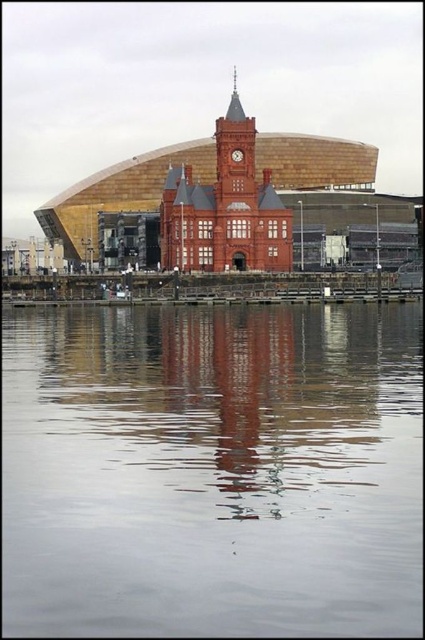
Question: Is smooth gray water at center above matte brick clock tower at center?

Choices:
 (A) yes
 (B) no

Answer: (B)

Question: Can you confirm if smooth gray water at center is bigger than matte brick clock tower at center?

Choices:
 (A) yes
 (B) no

Answer: (A)

Question: Which point is farther to the camera?

Choices:
 (A) (220, 218)
 (B) (189, 592)

Answer: (A)

Question: Where is smooth gray water at center located in relation to matte brick clock tower at center in the image?

Choices:
 (A) left
 (B) right

Answer: (B)

Question: Which of the following is the closest to the observer?

Choices:
 (A) (x=243, y=124)
 (B) (x=82, y=509)

Answer: (B)

Question: Which object appears farthest from the camera in this image?

Choices:
 (A) matte brick clock tower at center
 (B) smooth gray water at center

Answer: (A)